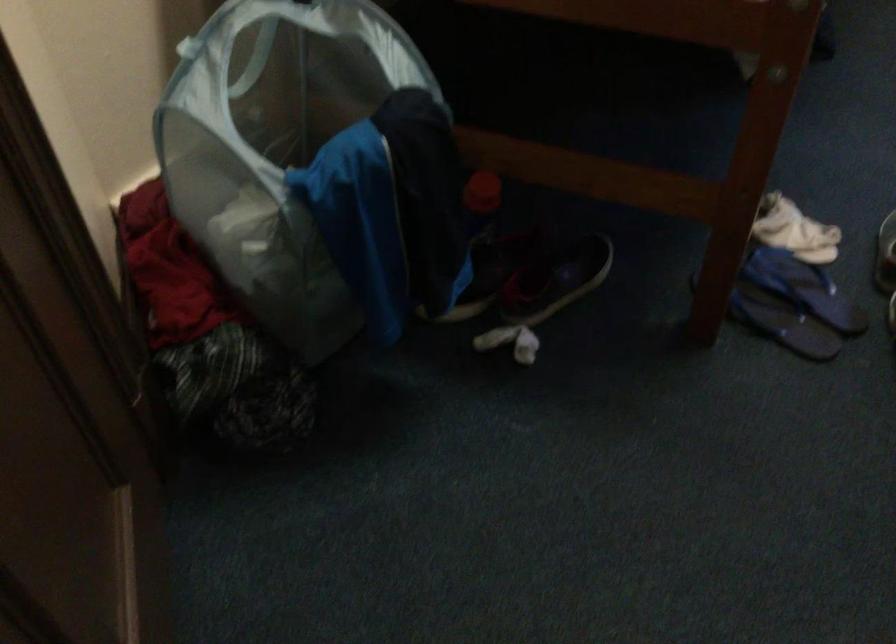
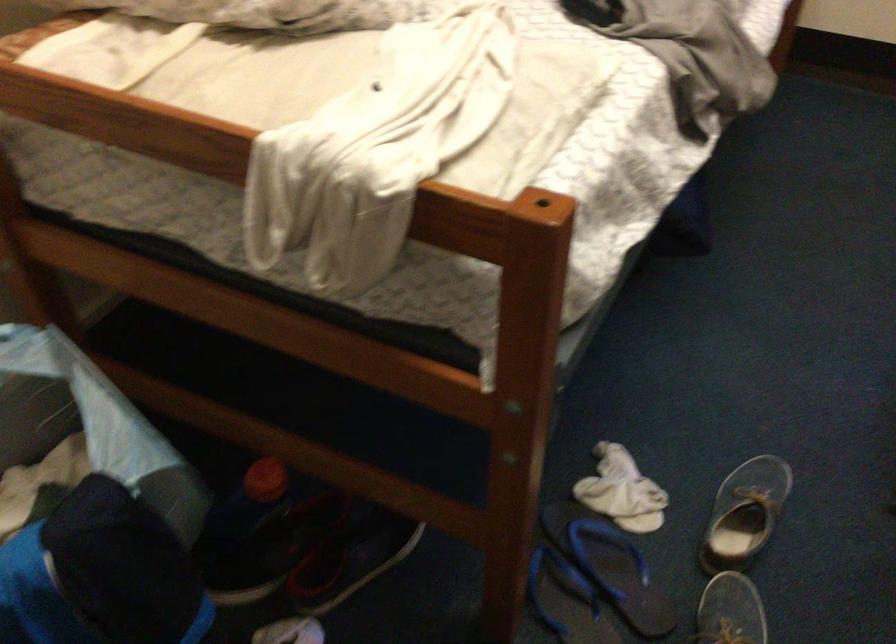
The point at (796, 287) is marked in the first image. Where is the corresponding point in the second image?

(609, 565)